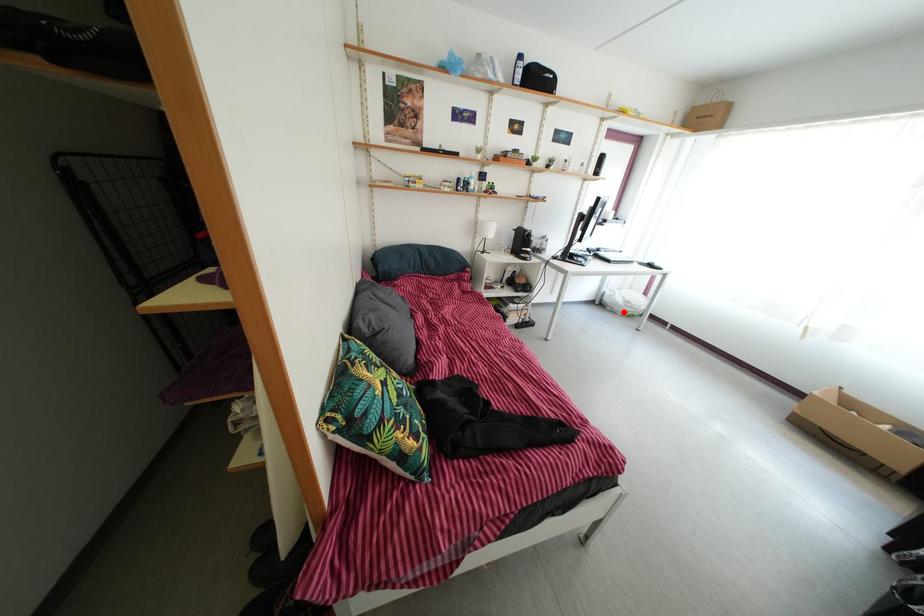
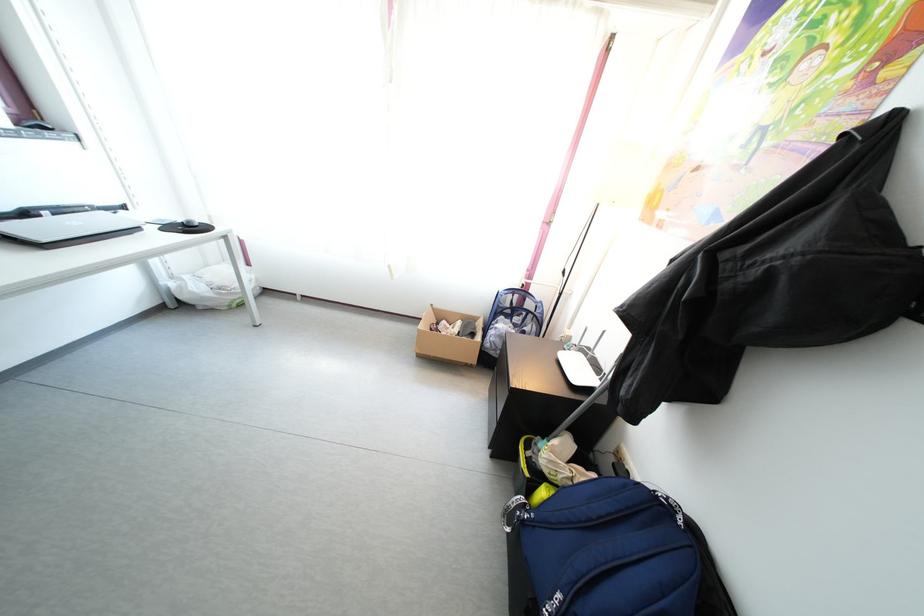
The point at the highlighted location is marked in the first image. Where is the corresponding point in the second image?

(210, 306)